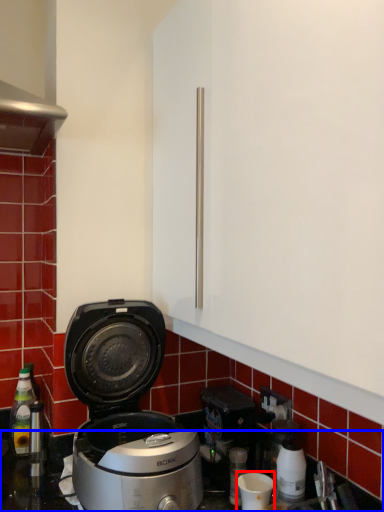
Question: Which point is further to the camera, appliance (highlighted by a red box) or counter top (highlighted by a blue box)?

Choices:
 (A) appliance
 (B) counter top

Answer: (A)